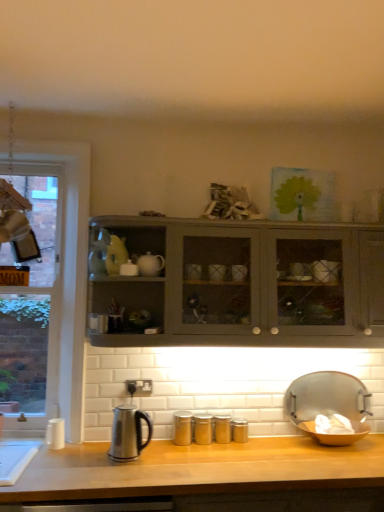
Question: Which is correct: matte gray cabinet at center is inside wooden at center, or outside of it?

Choices:
 (A) inside
 (B) outside

Answer: (B)

Question: From the image's perspective, is matte gray cabinet at center above or below wooden at center?

Choices:
 (A) above
 (B) below

Answer: (A)

Question: Which object is positioned closest to the metallic silver tray at lower right?

Choices:
 (A) matte gray cabinet at center
 (B) clear glass window at left
 (C) stainless steel kettle at lower left
 (D) wooden at center

Answer: (D)

Question: Considering the real-world distances, which object is closest to the stainless steel kettle at lower left?

Choices:
 (A) clear glass window at left
 (B) matte gray cabinet at center
 (C) metallic silver tray at lower right
 (D) wooden at center

Answer: (D)